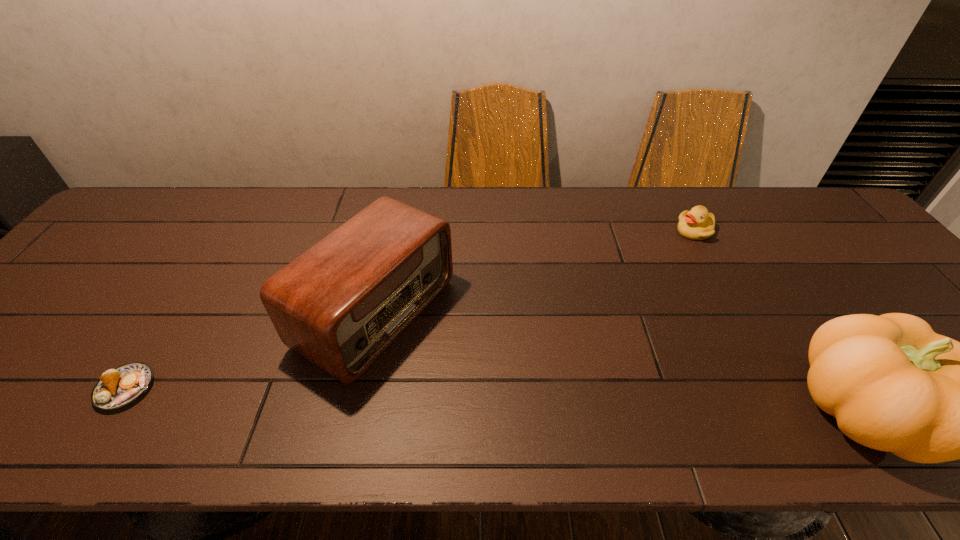
Find the location of a particular element. The width and height of the screenshot is (960, 540). vacant space positioned 0.130m on the front panel of the second object from left to right is located at coordinates (486, 377).

Where is `free region located 0.070m on the front panel of the second object from left to right`? free region located 0.070m on the front panel of the second object from left to right is located at coordinates (463, 365).

Where is `object at the far edge`? object at the far edge is located at coordinates (697, 224).

The image size is (960, 540). I want to click on pastry positioned at the near edge, so click(x=118, y=387).

I want to click on radio receiver positioned at the near edge, so 343,302.

The width and height of the screenshot is (960, 540). I want to click on free space at the far edge of the desktop, so click(x=541, y=219).

Where is `free location at the near edge of the desktop`? free location at the near edge of the desktop is located at coordinates (504, 383).

In the image, there is a desktop. Identify the location of free space at the left edge. (77, 319).

The width and height of the screenshot is (960, 540). Identify the location of vacant space at the far right corner of the desktop. (814, 199).

The width and height of the screenshot is (960, 540). What are the coordinates of `empty space between the second object from left to right and the duckling` in the screenshot? It's located at (536, 272).